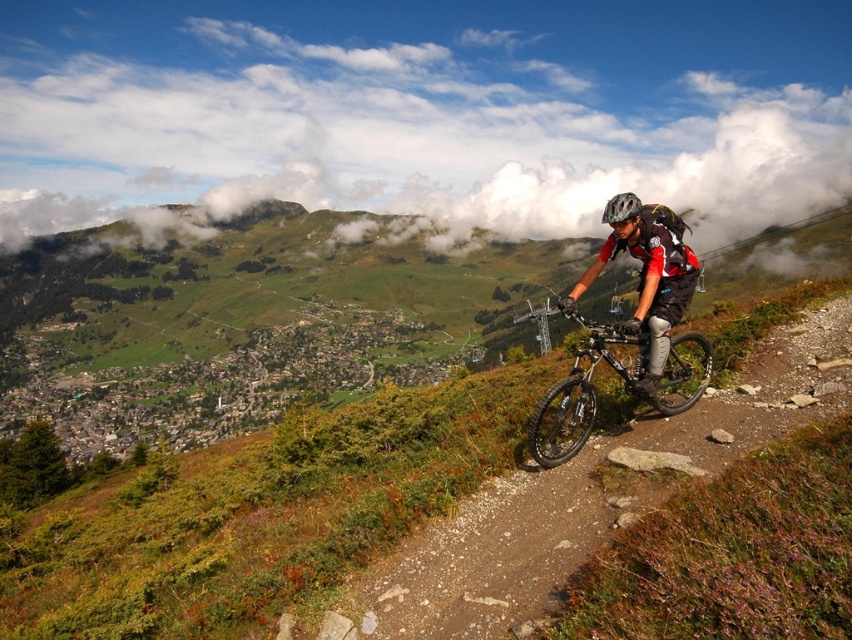
You are a drone operator trying to capture a photo of the white fluffy cloud at upper center and the shiny black frame at right. The drone has a maximum range of 2000 feet. Can the drone safely capture both objects in one photo without exceeding its range?

The distance between the white fluffy cloud at upper center and the shiny black frame at right is 2050.90 feet, which exceeds the drone operator maximum range of 2000 feet. The drone cannot safely capture both objects in one photo without exceeding its range.

You are a photographer trying to capture a clear shot of the shiny black frame at right and the shiny black helmet at upper right. Which object should you focus on first if you want to ensure both are in focus without moving the camera?

The shiny black frame at right is positioned on the right side of the shiny black helmet at upper right, so you should focus on the shiny black helmet at upper right first since it is closer to the camera, ensuring both will be in focus when using a shallow depth of field.